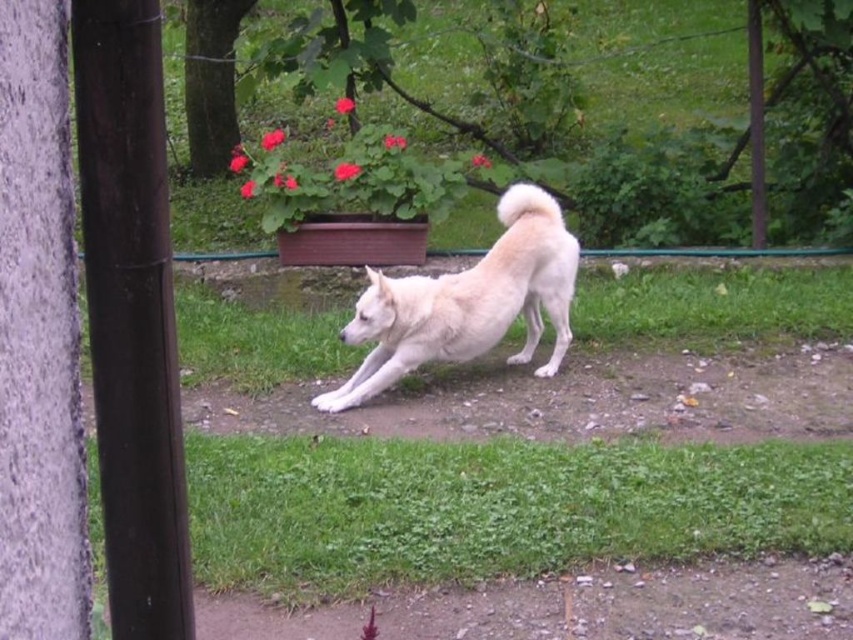
Can you confirm if green grass at lower center is thinner than white fluffy dog at center?

In fact, green grass at lower center might be wider than white fluffy dog at center.

Does green grass at lower center lie behind white fluffy dog at center?

No, green grass at lower center is in front of white fluffy dog at center.

Where is `green grass at lower center`? green grass at lower center is located at coordinates (496, 508).